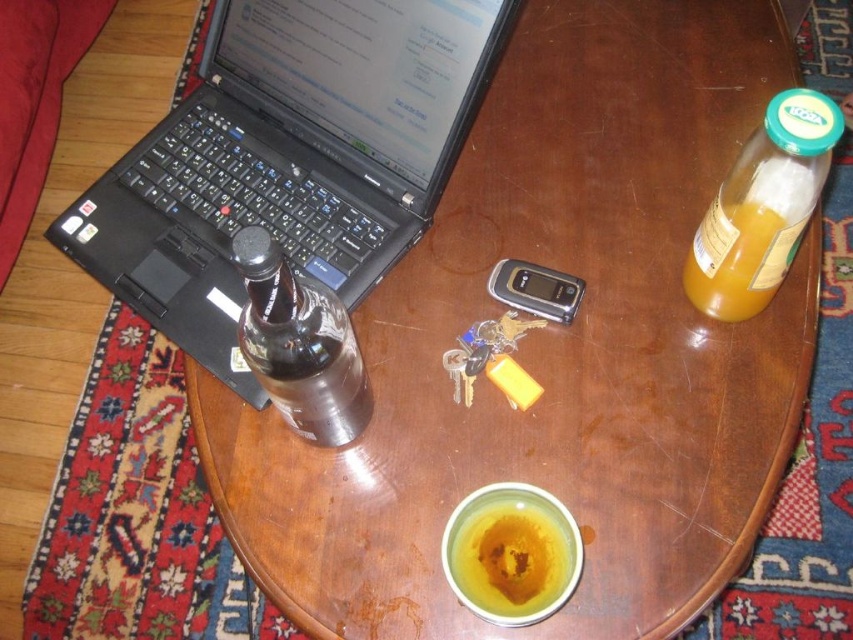
Does point (163, 172) come in front of point (695, 292)?

No, (163, 172) is behind (695, 292).

Does black plastic laptop at left have a greater height compared to translucent plastic bottle at upper right?

Correct, black plastic laptop at left is much taller as translucent plastic bottle at upper right.

Who is more forward, (x=100, y=244) or (x=790, y=227)?

Point (x=790, y=227) is more forward.

At what (x,y) coordinates should I click in order to perform the action: click on black plastic laptop at left. Please return your answer as a coordinate pair (x, y). Looking at the image, I should click on (288, 157).

Does translucent plastic bottle at upper right have a greater width compared to transparent glass bottle at left?

Correct, the width of translucent plastic bottle at upper right exceeds that of transparent glass bottle at left.

Is the position of translucent plastic bottle at upper right less distant than that of transparent glass bottle at left?

No, translucent plastic bottle at upper right is behind transparent glass bottle at left.

Between point (747, 259) and point (250, 348), which one is positioned in front?

Point (250, 348) is more forward.

The height and width of the screenshot is (640, 853). Find the location of `translucent plastic bottle at upper right`. translucent plastic bottle at upper right is located at coordinates 762,205.

Is transparent glass bottle at left above yellow matte cup at center?

Yes, transparent glass bottle at left is above yellow matte cup at center.

Does point (289, 378) lie in front of point (517, 536)?

Yes, it is.

Where is `transparent glass bottle at left`? The height and width of the screenshot is (640, 853). transparent glass bottle at left is located at coordinates (299, 344).